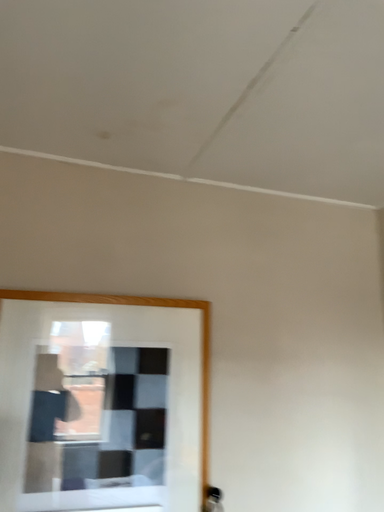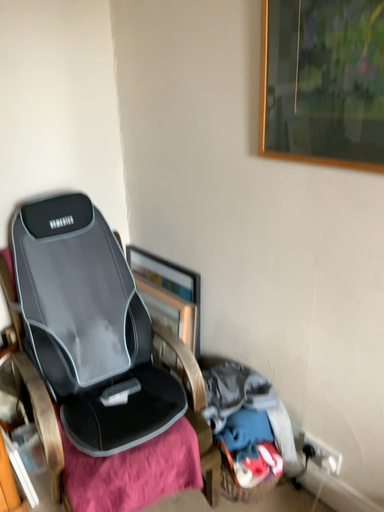
Question: How did the camera likely rotate when shooting the video?

Choices:
 (A) rotated right
 (B) rotated left

Answer: (A)